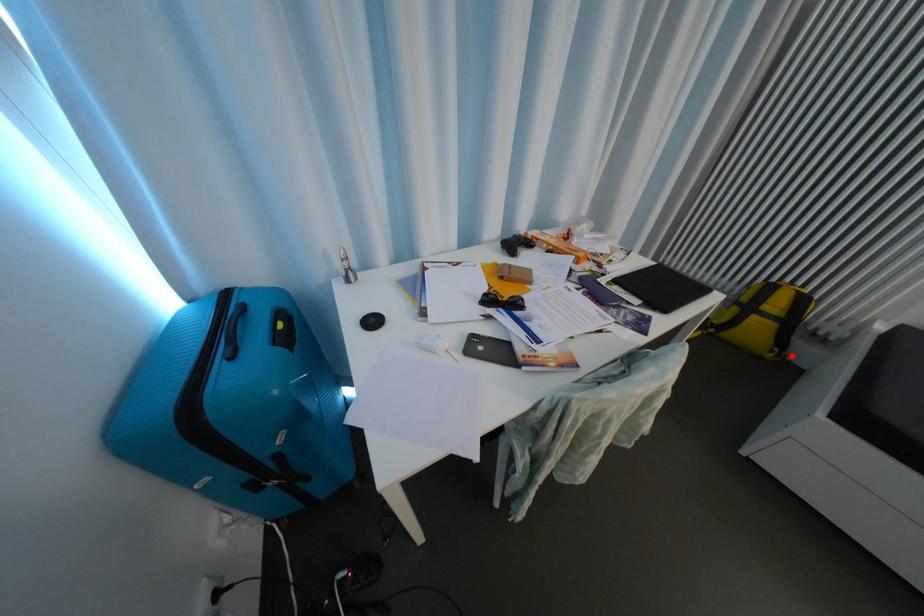
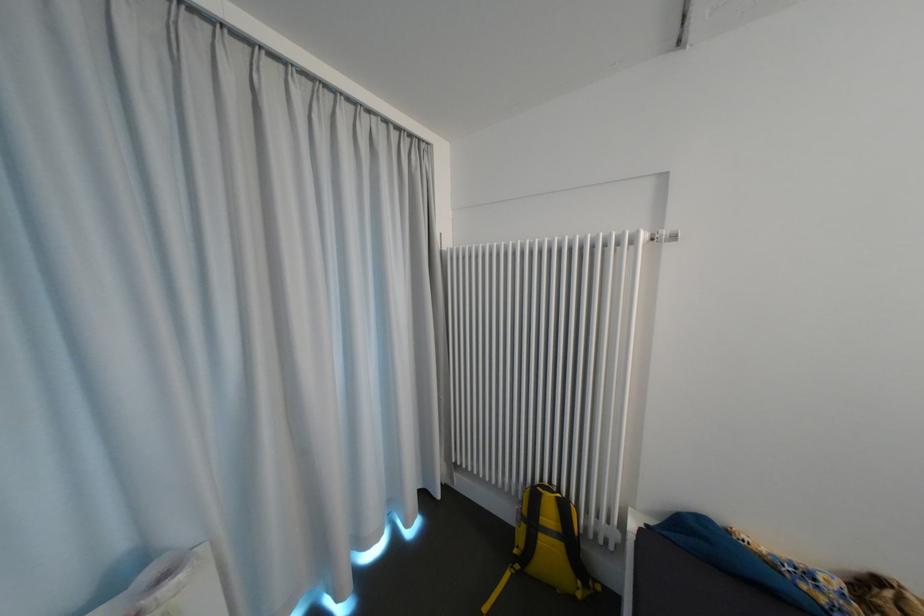
Question: I am providing you with two images of the same scene from different viewpoints. Image1 has a red point marked. In image2, the corresponding 3D location appears at what relative position? Reply with the corresponding letter.

Choices:
 (A) Closer
 (B) Farther

Answer: (B)